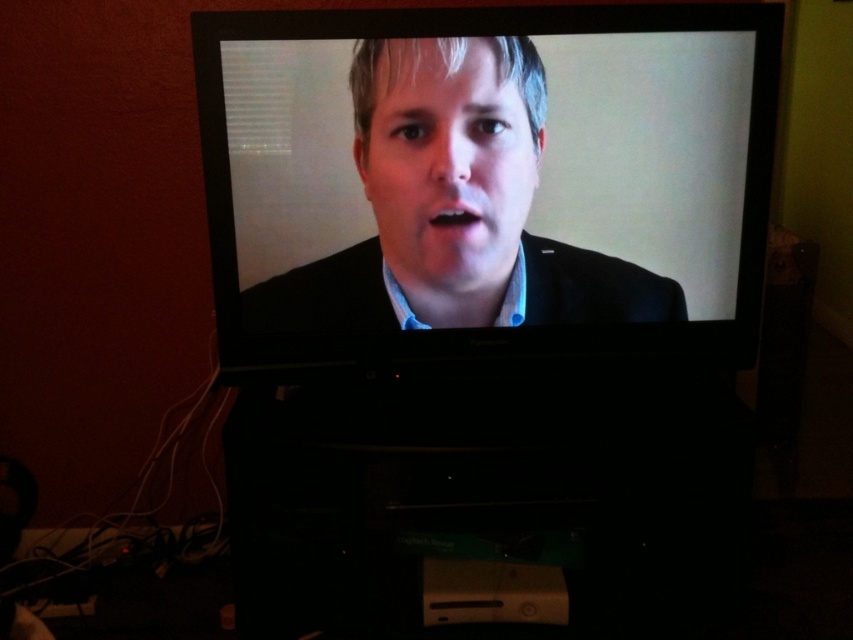
You are standing in front of the Panasonic television screen. There is a point marked at coordinates (456, 205). What object does this point correspond to?

The point at coordinates (456, 205) corresponds to the matte black suit at center.

You are a security camera monitoring the room. You notice the matte black face at center and the black matte business suit at center. Which object is closer to the camera?

The matte black face at center is closer to the camera because it is in front of the black matte business suit at center.